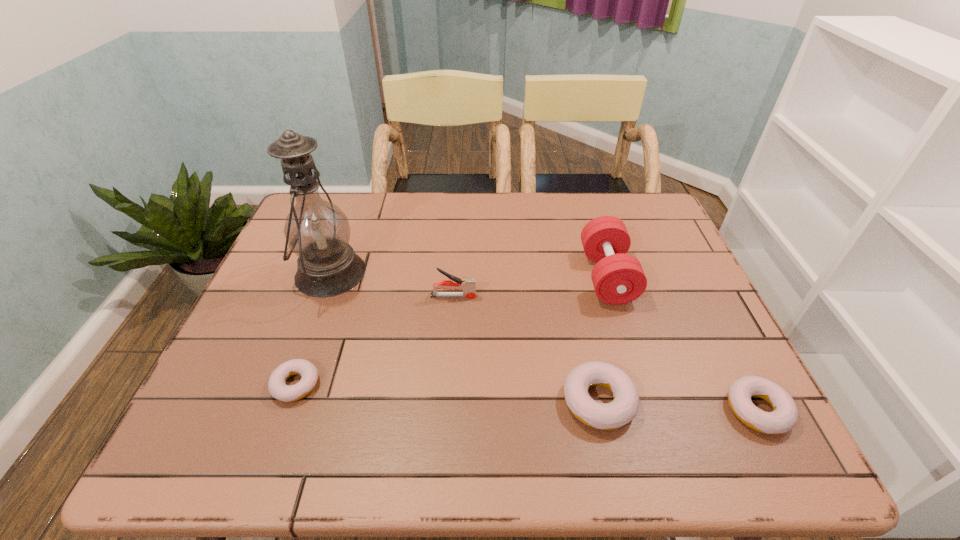
Find the location of a particular element. The width and height of the screenshot is (960, 540). free space between the second tallest doughnut and the tallest doughnut is located at coordinates (678, 406).

Where is `free spot between the tallest doughnut and the oil lamp`? Image resolution: width=960 pixels, height=540 pixels. free spot between the tallest doughnut and the oil lamp is located at coordinates (465, 337).

Locate an element on the screen. The image size is (960, 540). free space between the shortest doughnut and the second doughnut from right to left is located at coordinates (447, 393).

You are a GUI agent. You are given a task and a screenshot of the screen. Output one action in this format:
    pyautogui.click(x=<x>, y=<y>)
    Task: Click on the free space between the dumbbell and the second doughnut from right to left
    Image resolution: width=960 pixels, height=540 pixels.
    Given the screenshot: What is the action you would take?
    pyautogui.click(x=603, y=339)

The image size is (960, 540). Find the location of `free spot between the leftmost doughnut and the tallest doughnut`. free spot between the leftmost doughnut and the tallest doughnut is located at coordinates (447, 393).

Identify the location of unoccupied area between the third tallest object and the shortest doughnut. The width and height of the screenshot is (960, 540). (374, 340).

Where is `empty location between the dumbbell and the stapler`? This screenshot has width=960, height=540. empty location between the dumbbell and the stapler is located at coordinates (530, 286).

Image resolution: width=960 pixels, height=540 pixels. In order to click on object that stands as the fourth closest to the second tallest object in this screenshot , I will do `click(317, 231)`.

Where is `object that ranks as the second closest to the dumbbell`? This screenshot has width=960, height=540. object that ranks as the second closest to the dumbbell is located at coordinates (784, 416).

Where is `doughnut that is the nearest to the tallest object`? The image size is (960, 540). doughnut that is the nearest to the tallest object is located at coordinates (277, 386).